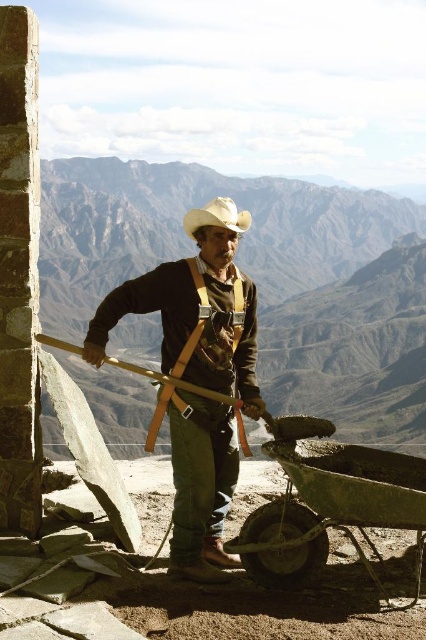
In the scene shown: You are a drone operator trying to capture the man working in the mountainous landscape. You need to fly your drone from point A to point B. Point A is at coordinates point [301,502] and point B is at coordinates point [221,220]. Which point should you start your drone from to ensure it is closer to the camera for a better shot?

You should start the drone from point [221,220] because it is closer to the camera than point [301,502].